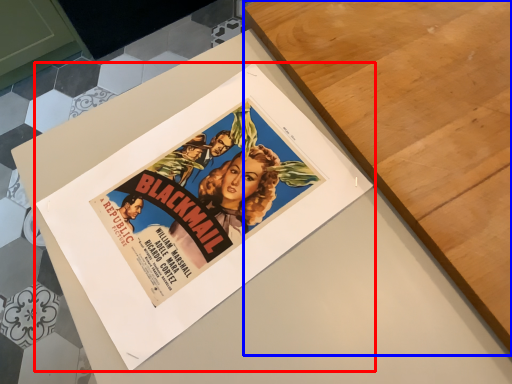
Question: Which of the following is the closest to the observer, poster (highlighted by a red box) or table (highlighted by a blue box)?

Choices:
 (A) poster
 (B) table

Answer: (A)